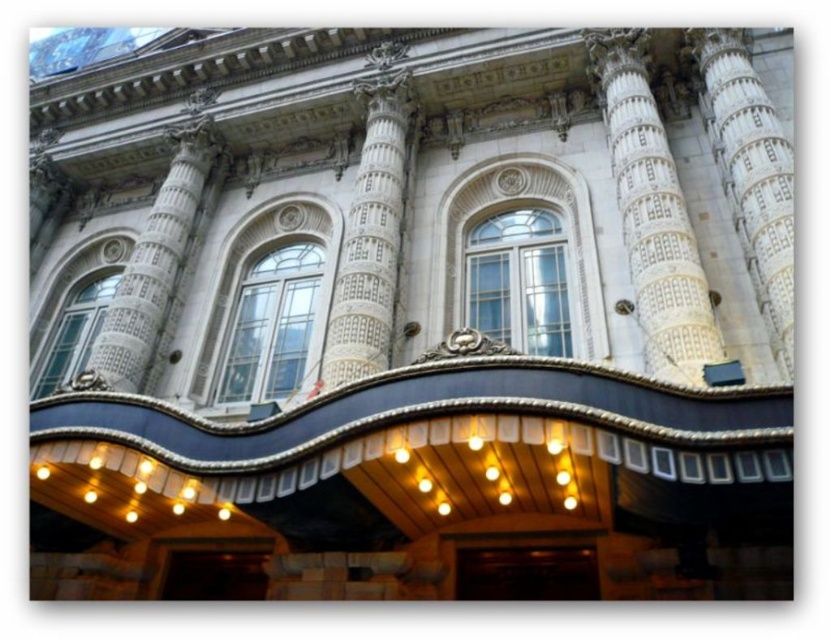
Is white stone column at center to the right of white marble column at upper left from the viewer's perspective?

Correct, you'll find white stone column at center to the right of white marble column at upper left.

Which is below, white stone column at center or white marble column at upper left?

white marble column at upper left

Find the location of `white stone column at center`. white stone column at center is located at coordinates (652, 214).

At what (x,y) coordinates should I click in order to perform the action: click on white stone column at center. Please return your answer as a coordinate pair (x, y). Looking at the image, I should click on (652, 214).

How much distance is there between white marble column at center and white marble column at upper left?

white marble column at center and white marble column at upper left are 55.11 meters apart.

Between point (756, 156) and point (210, 120), which one is positioned behind?

The point (210, 120) is behind.

Which is behind, point (779, 360) or point (220, 150)?

The point (220, 150) is more distant.

The height and width of the screenshot is (640, 831). Identify the location of white marble column at center. (751, 173).

Between white stone column at center and white marble column at center, which one has less height?

white marble column at center is shorter.

Who is taller, white stone column at center or white marble column at center?

white stone column at center

The image size is (831, 640). Describe the element at coordinates (652, 214) in the screenshot. I see `white stone column at center` at that location.

At what (x,y) coordinates should I click in order to perform the action: click on white stone column at center. Please return your answer as a coordinate pair (x, y). The height and width of the screenshot is (640, 831). Looking at the image, I should click on (652, 214).